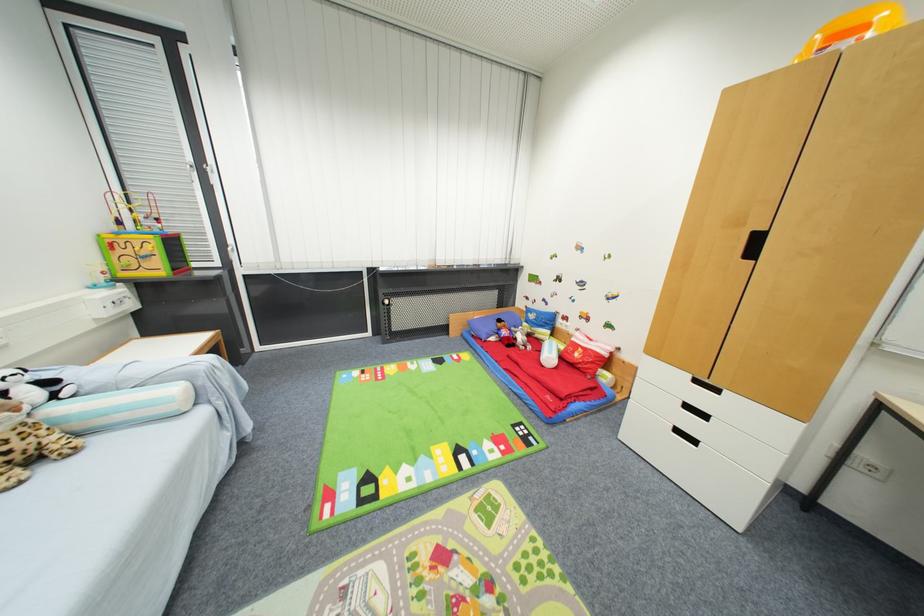
The height and width of the screenshot is (616, 924). What do you see at coordinates (209, 172) in the screenshot? I see `the silver window handle` at bounding box center [209, 172].